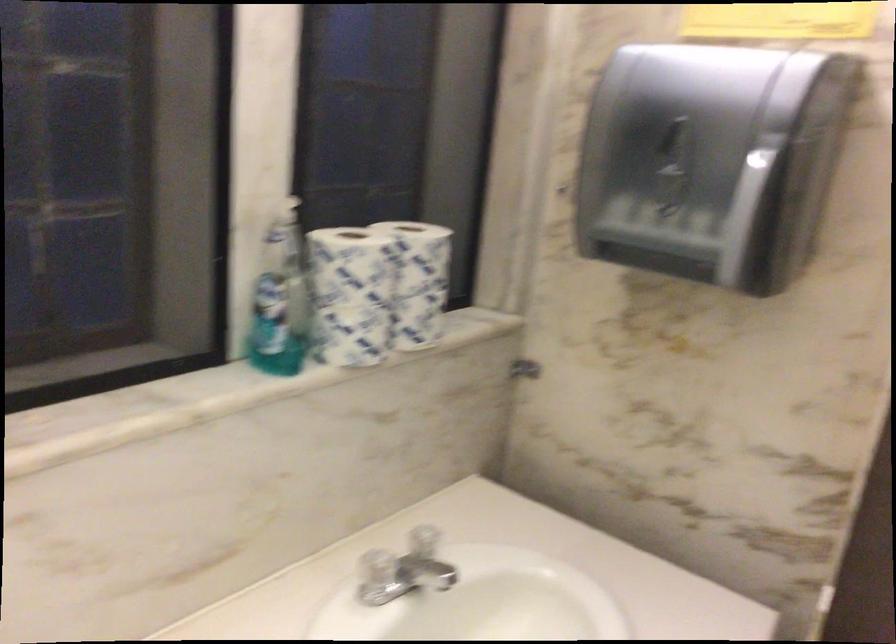
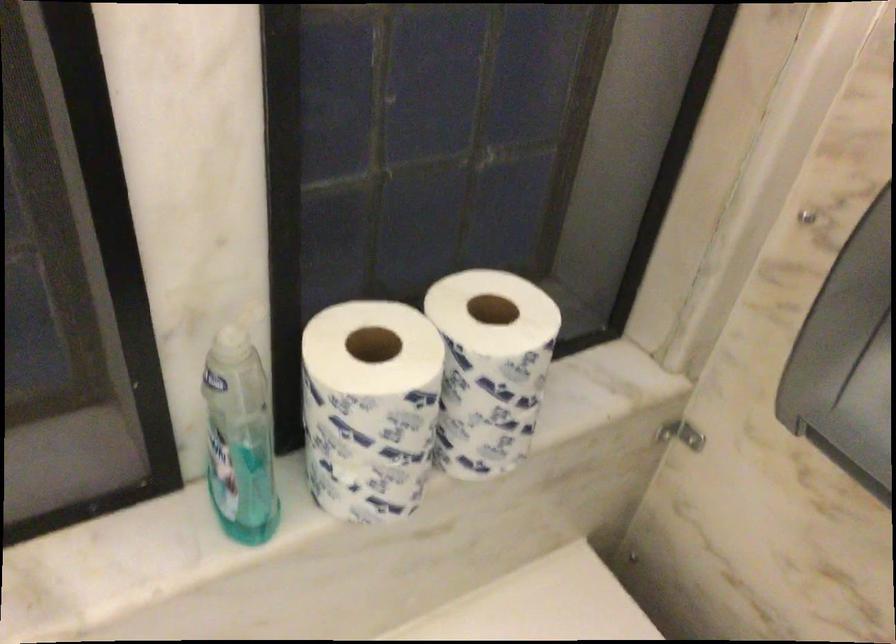
How did the camera likely rotate?

The camera rotated toward left-down.